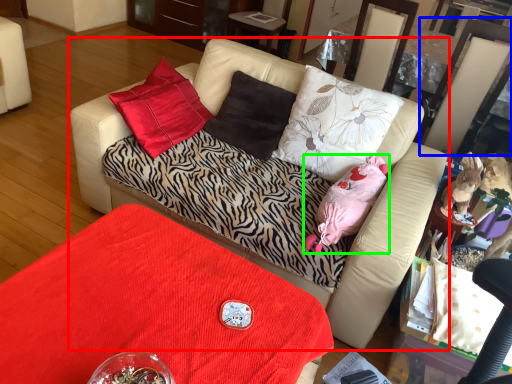
Question: Based on their relative distances, which object is nearer to studio couch (highlighted by a red box)? Choose from swivel chair (highlighted by a blue box) and animal (highlighted by a green box).

Choices:
 (A) swivel chair
 (B) animal

Answer: (B)